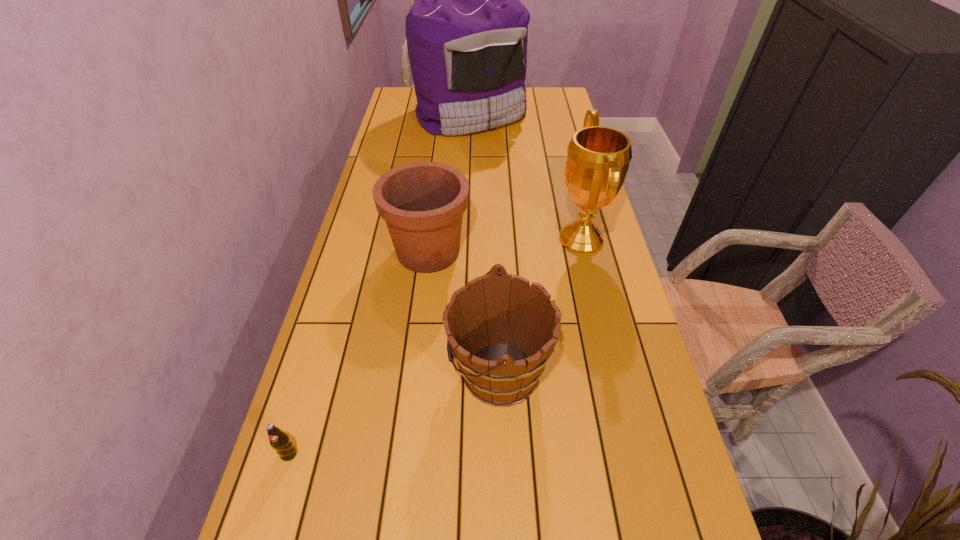
This screenshot has height=540, width=960. I want to click on the tallest object, so click(x=467, y=33).

At what (x,y) coordinates should I click in order to perform the action: click on backpack. Please return your answer as a coordinate pair (x, y). This screenshot has width=960, height=540. Looking at the image, I should click on (467, 33).

Where is `award`? award is located at coordinates (598, 157).

Locate an element on the screen. This screenshot has width=960, height=540. the rightmost object is located at coordinates (598, 157).

Identify the location of the second nearest object. (479, 318).

You are a GUI agent. You are given a task and a screenshot of the screen. Output one action in this format:
    pyautogui.click(x=<x>, y=<y>)
    Task: Click on the flowerpot
    This screenshot has height=540, width=960.
    Given the screenshot: What is the action you would take?
    pyautogui.click(x=422, y=203)

You are a GUI agent. You are given a task and a screenshot of the screen. Output one action in this format:
    pyautogui.click(x=<x>, y=<y>)
    Task: Click on the shortest object
    Image resolution: width=960 pixels, height=540 pixels.
    Given the screenshot: What is the action you would take?
    pyautogui.click(x=279, y=440)

Identify the location of pop. This screenshot has height=540, width=960. (279, 440).

Find the location of a particular element. The height and width of the screenshot is (540, 960). vacant space located on the front pocket of the tallest object is located at coordinates (469, 163).

Find the location of a particular element. The height and width of the screenshot is (540, 960). free space located on the front-facing side of the fourth shortest object is located at coordinates (436, 239).